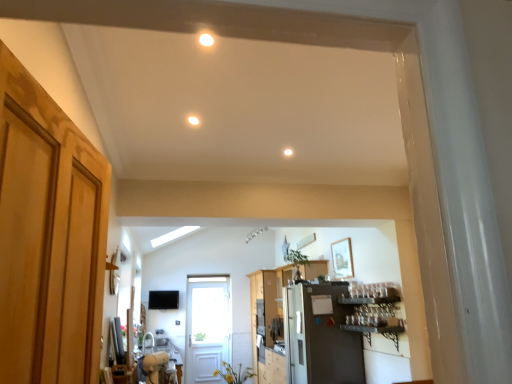
The height and width of the screenshot is (384, 512). In order to click on free space to the right of matte white light fixture at center, arranged as the 2th lighting when viewed from the top in this screenshot , I will do `click(217, 119)`.